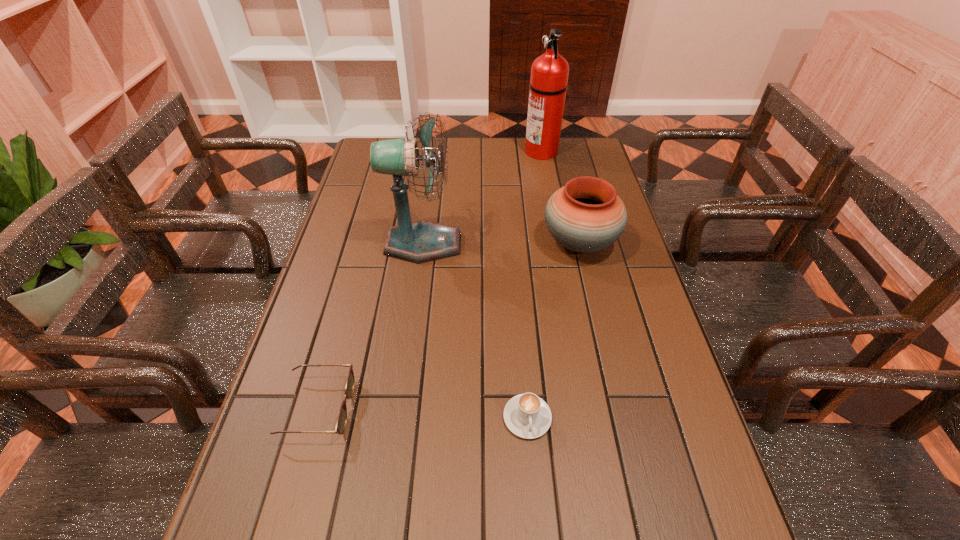
You are a GUI agent. You are given a task and a screenshot of the screen. Output one action in this format:
    pyautogui.click(x=<x>, y=<y>)
    Task: Click on the blank space at the far right corner of the desktop
    
    Given the screenshot: What is the action you would take?
    pyautogui.click(x=562, y=168)

Locate an element on the screen. This screenshot has width=960, height=540. free space between the spectacles and the cappuccino is located at coordinates (422, 413).

Image resolution: width=960 pixels, height=540 pixels. I want to click on vacant region between the third object from right to left and the fan, so click(475, 330).

Where is `free spot between the spectacles and the fan`? The image size is (960, 540). free spot between the spectacles and the fan is located at coordinates (371, 326).

Image resolution: width=960 pixels, height=540 pixels. Find the location of `free space between the third object from left to right and the fan`. free space between the third object from left to right and the fan is located at coordinates (475, 330).

Identify the location of free space between the fan and the pottery. This screenshot has height=540, width=960. [501, 244].

Locate an element on the screen. empty location between the spectacles and the fire extinguisher is located at coordinates (430, 280).

I want to click on blank region between the fan and the spectacles, so click(x=371, y=326).

This screenshot has width=960, height=540. What are the coordinates of `blank region between the spectacles and the fan` in the screenshot? It's located at (371, 326).

In order to click on free spot between the farthest object and the third object from right to left in this screenshot , I will do `click(535, 284)`.